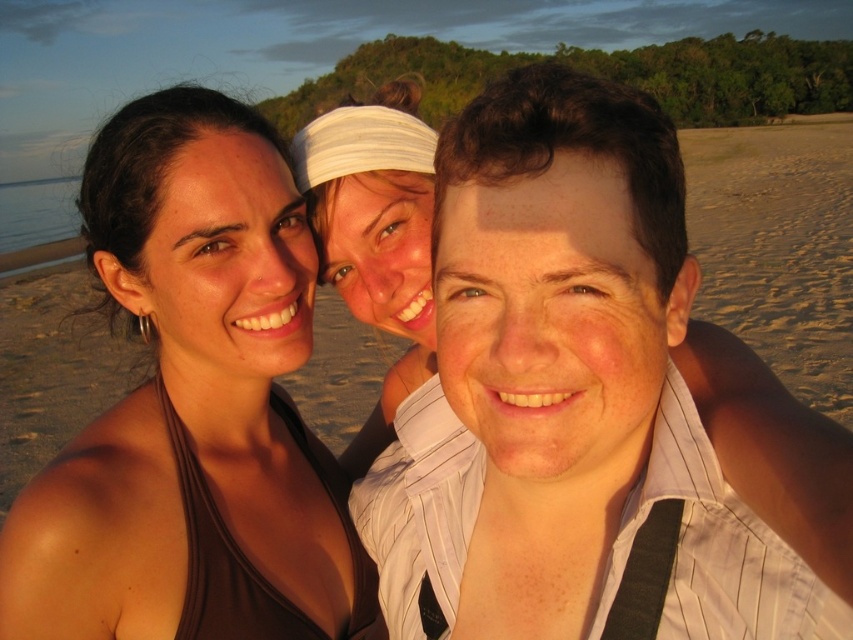
Is brown fabric top at left to the left of white fabric headband at center from the viewer's perspective?

Yes, brown fabric top at left is to the left of white fabric headband at center.

Does brown fabric top at left have a lesser width compared to white fabric headband at center?

In fact, brown fabric top at left might be wider than white fabric headband at center.

The image size is (853, 640). Find the location of `brown fabric top at left`. brown fabric top at left is located at coordinates (192, 406).